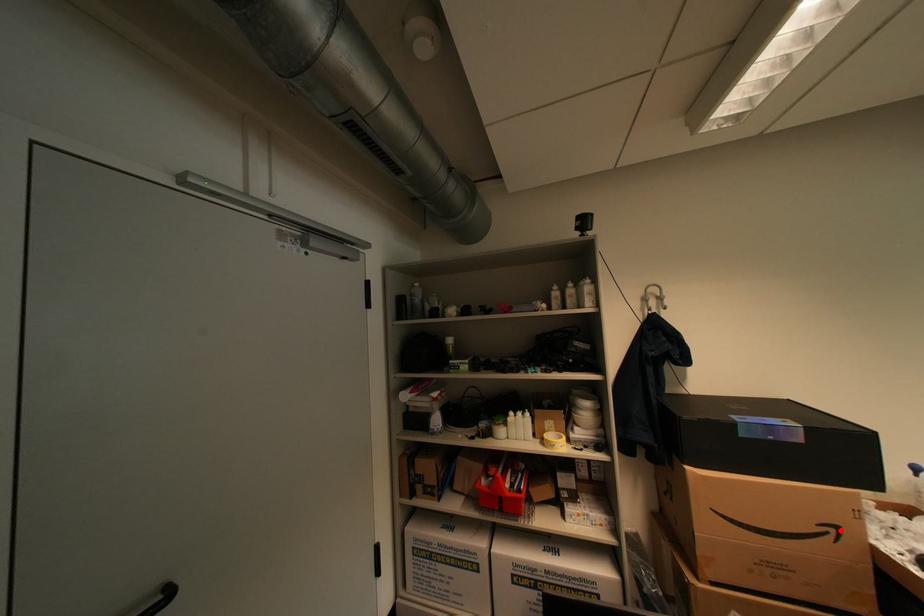
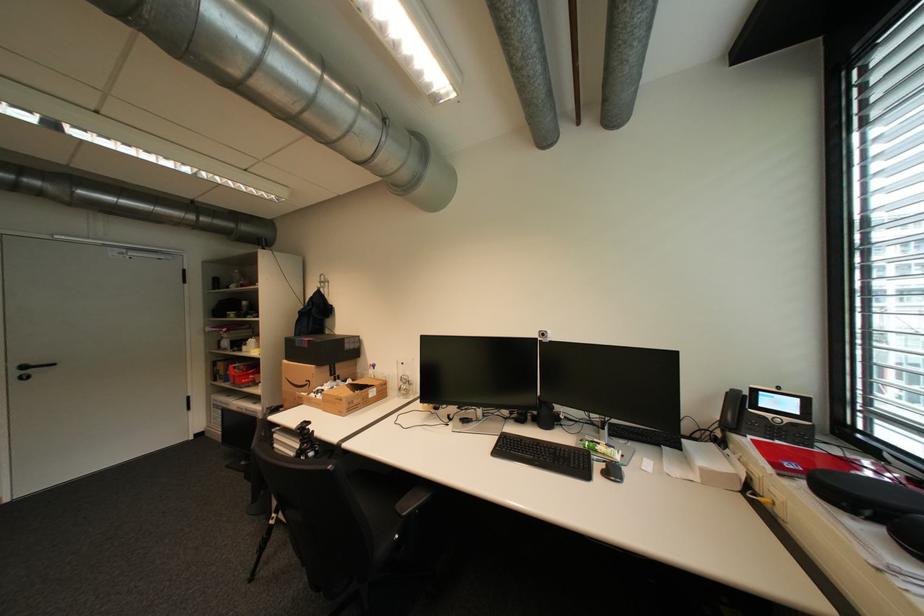
Question: I am providing you with two images of the same scene from different viewpoints. A red point is shown in image1. For the corresponding object point in image2, is it positioned nearer or farther from the camera?

Choices:
 (A) Nearer
 (B) Farther

Answer: (B)